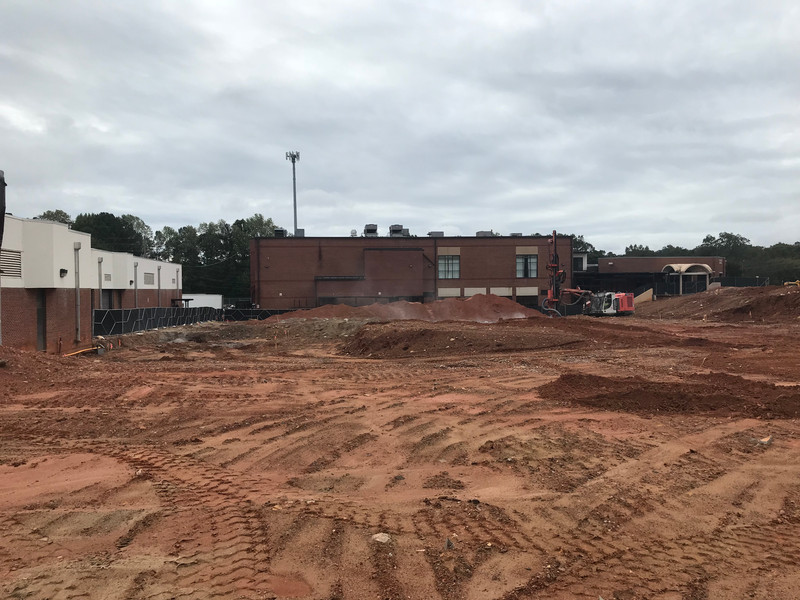
The height and width of the screenshot is (600, 800). What are the coordinates of `windows` in the screenshot? It's located at (449, 268), (524, 268), (576, 260).